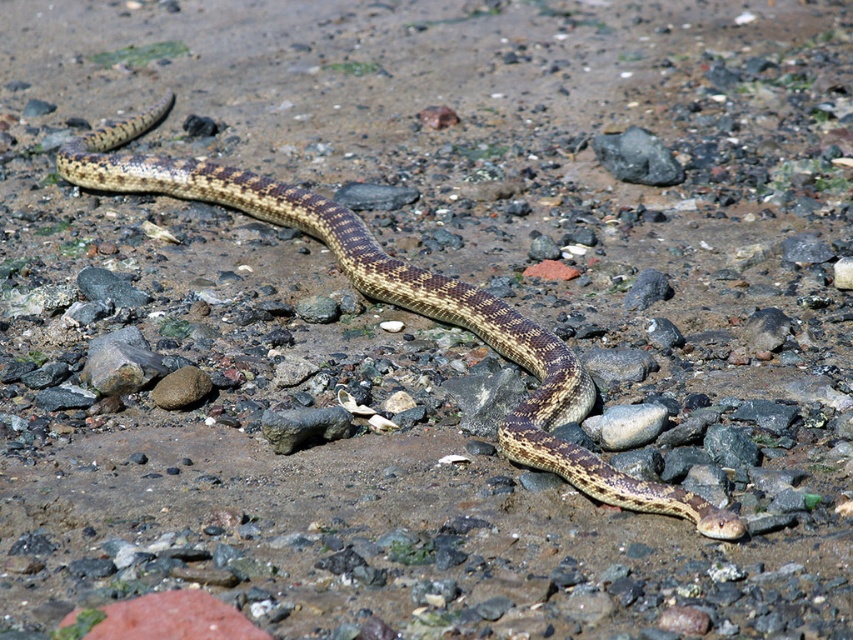
From the picture: Is speckled brown snake at center thinner than gray rock at center?

No.

Who is positioned more to the left, speckled brown snake at center or gray rock at center?

Positioned to the left is speckled brown snake at center.

Is point (466, 292) farther from camera compared to point (643, 296)?

No, it is not.

Locate an element on the screen. speckled brown snake at center is located at coordinates (404, 307).

Which is more to the right, speckled brown snake at center or smooth gray rock at center?

Positioned to the right is smooth gray rock at center.

Does point (660, 499) come in front of point (674, 179)?

Yes, it is.

I want to click on speckled brown snake at center, so click(404, 307).

Consider the image. Is smooth gray rock at center bigger than brown rough rock at center?

Indeed, smooth gray rock at center has a larger size compared to brown rough rock at center.

Does smooth gray rock at center lie behind brown rough rock at center?

Yes.

Is point (675, 166) positioned before point (160, 403)?

No, it is not.

You are a GUI agent. You are given a task and a screenshot of the screen. Output one action in this format:
    pyautogui.click(x=<x>, y=<y>)
    Task: Click on the smooth gray rock at center
    
    Given the screenshot: What is the action you would take?
    pyautogui.click(x=637, y=157)